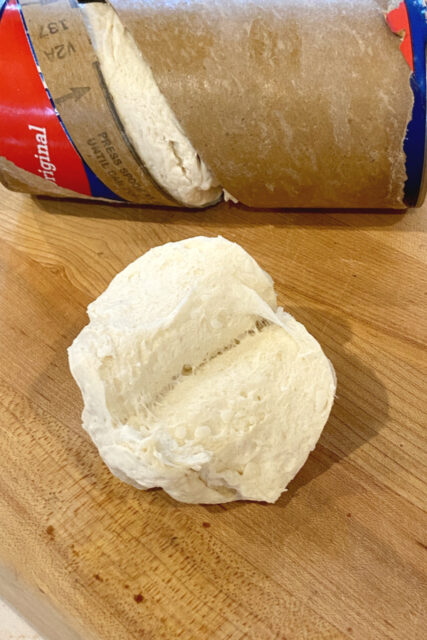
This screenshot has width=427, height=640. In order to click on empty space on table in this screenshot , I will do `click(367, 252)`, `click(325, 577)`, `click(23, 276)`.